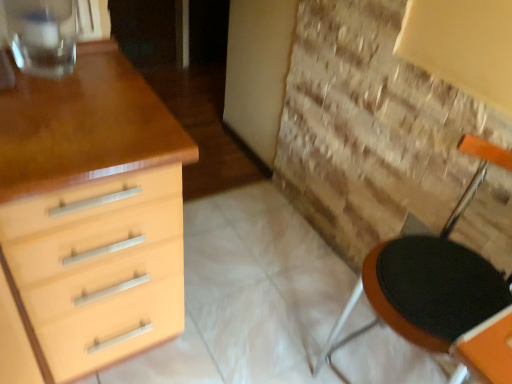
Question: From the image's perspective, is matte wood chest of drawers at left located above black fabric armchair at right?

Choices:
 (A) yes
 (B) no

Answer: (A)

Question: Is matte wood chest of drawers at left positioned behind black fabric armchair at right?

Choices:
 (A) no
 (B) yes

Answer: (A)

Question: Can you confirm if matte wood chest of drawers at left is wider than black fabric armchair at right?

Choices:
 (A) yes
 (B) no

Answer: (A)

Question: Is matte wood chest of drawers at left taller than black fabric armchair at right?

Choices:
 (A) yes
 (B) no

Answer: (A)

Question: Is matte wood chest of drawers at left smaller than black fabric armchair at right?

Choices:
 (A) no
 (B) yes

Answer: (A)

Question: Is matte wood chest of drawers at left facing towards black fabric armchair at right?

Choices:
 (A) no
 (B) yes

Answer: (A)

Question: Would you consider transparent glass at upper left to be distant from matte wood chest of drawers at left?

Choices:
 (A) no
 (B) yes

Answer: (A)

Question: Is transparent glass at upper left outside of matte wood chest of drawers at left?

Choices:
 (A) no
 (B) yes

Answer: (B)

Question: Is transparent glass at upper left touching matte wood chest of drawers at left?

Choices:
 (A) no
 (B) yes

Answer: (A)

Question: From a real-world perspective, does transparent glass at upper left sit lower than matte wood chest of drawers at left?

Choices:
 (A) yes
 (B) no

Answer: (B)

Question: Is transparent glass at upper left behind matte wood chest of drawers at left?

Choices:
 (A) yes
 (B) no

Answer: (A)

Question: From the image's perspective, does transparent glass at upper left appear higher than matte wood chest of drawers at left?

Choices:
 (A) yes
 (B) no

Answer: (A)

Question: Is transparent glass at upper left at the back of matte wood chest of drawers at left?

Choices:
 (A) yes
 (B) no

Answer: (B)